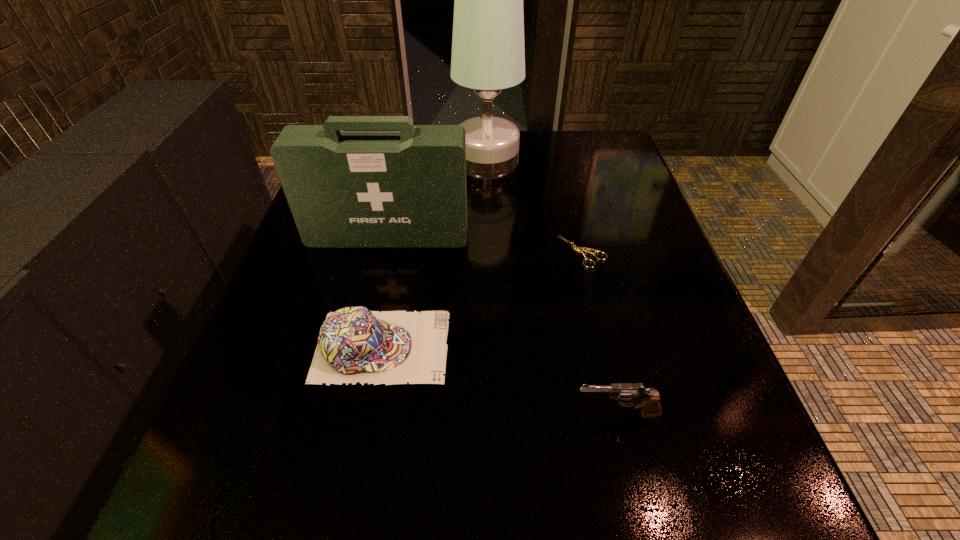
Find the location of `vacant space in between the first-aid kit and the pistol`. vacant space in between the first-aid kit and the pistol is located at coordinates (502, 325).

Find the location of a particular element. vacant region between the shortest object and the first-aid kit is located at coordinates (486, 244).

You are a GUI agent. You are given a task and a screenshot of the screen. Output one action in this format:
    pyautogui.click(x=<x>, y=<y>)
    Task: Click on the object that is the third closest to the shears
    The width and height of the screenshot is (960, 540).
    Given the screenshot: What is the action you would take?
    pyautogui.click(x=488, y=55)

You are a GUI agent. You are given a task and a screenshot of the screen. Output one action in this format:
    pyautogui.click(x=<x>, y=<y>)
    Task: Click on the object that stands as the third closest to the second tallest object
    
    Given the screenshot: What is the action you would take?
    pyautogui.click(x=488, y=55)

Identify the location of free spot that satisfies the following two spatial constraints: 1. on the base of the farthest object; 2. on the front-facing side of the first-aid kit. (489, 235).

Image resolution: width=960 pixels, height=540 pixels. Find the location of `free spot that satisfies the following two spatial constraints: 1. on the base of the farthest object; 2. on the front-facing side of the fourth shortest object`. free spot that satisfies the following two spatial constraints: 1. on the base of the farthest object; 2. on the front-facing side of the fourth shortest object is located at coordinates (489, 235).

Identify the location of blank space that satisfies the following two spatial constraints: 1. on the front-facing side of the shortest object; 2. on the right side of the second tallest object. (385, 252).